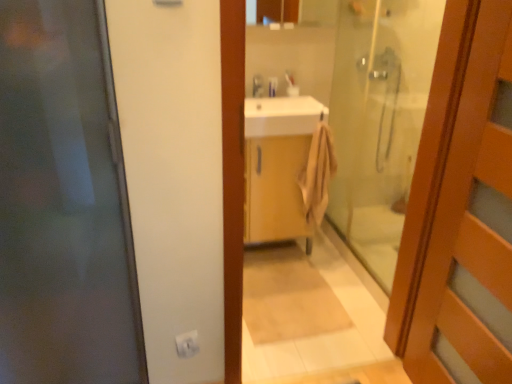
Image resolution: width=512 pixels, height=384 pixels. What do you see at coordinates (273, 86) in the screenshot?
I see `white plastic toothbrush at center, marked as the second toiletry in a right-to-left arrangement` at bounding box center [273, 86].

Image resolution: width=512 pixels, height=384 pixels. Identify the location of wooden door at right, which is the first door in right-to-left order. (472, 227).

Where is `matte silver faucet at upper center`? This screenshot has height=384, width=512. matte silver faucet at upper center is located at coordinates 257,86.

Is white plastic toothbrush at center, the first toiletry in the left-to-right sequence, not inside white plastic electric outlet at lower center?

white plastic toothbrush at center, the first toiletry in the left-to-right sequence, lies outside white plastic electric outlet at lower center's area.

Does white plastic toothbrush at center, the first toiletry in the left-to-right sequence, appear on the right side of white plastic electric outlet at lower center?

Yes, white plastic toothbrush at center, the first toiletry in the left-to-right sequence, is to the right of white plastic electric outlet at lower center.

Does point (270, 93) appear closer or farther from the camera than point (194, 344)?

Point (270, 93) is positioned farther from the camera compared to point (194, 344).

Is white plastic toothbrush at center, marked as the second toiletry in a right-to-left arrangement, oriented away from white plastic electric outlet at lower center?

No, white plastic toothbrush at center, marked as the second toiletry in a right-to-left arrangement,'s orientation is not away from white plastic electric outlet at lower center.

Is wooden door at right, which appears as the 2th door when viewed from the left, shorter than white glossy sink at center?

Incorrect, the height of wooden door at right, which appears as the 2th door when viewed from the left, does not fall short of that of white glossy sink at center.

Is the surface of wooden door at right, which is the first door in right-to-left order, in direct contact with white glossy sink at center?

wooden door at right, which is the first door in right-to-left order, is not next to white glossy sink at center, and they're not touching.

Locate an element on the screen. the 2nd door below the white glossy sink at center (from the image's perspective) is located at coordinates (472, 227).

From a real-world perspective, is wooden door at right, which is the first door in right-to-left order, above or below white glossy sink at center?

Clearly, from a real-world perspective, wooden door at right, which is the first door in right-to-left order, is below white glossy sink at center.

Is point (508, 326) closer or farther from the camera than point (314, 201)?

Clearly, point (508, 326) is closer to the camera than point (314, 201).

Does wooden door at right, which is the first door in right-to-left order, have a greater width compared to beige cotton towel at center?

In fact, wooden door at right, which is the first door in right-to-left order, might be narrower than beige cotton towel at center.

Is wooden door at right, which is the first door in right-to-left order, aimed at beige cotton towel at center?

No, wooden door at right, which is the first door in right-to-left order, is not oriented towards beige cotton towel at center.

In the scene shown: How many degrees apart are the facing directions of wooden door at right, which is the first door in right-to-left order, and beige cotton towel at center?

The angular difference between wooden door at right, which is the first door in right-to-left order, and beige cotton towel at center is 90.7 degrees.

Which of these two, white plastic electric outlet at lower center or white glossy sink at center, is bigger?

white glossy sink at center is bigger.

From the image's perspective, does white plastic electric outlet at lower center appear lower than white glossy sink at center?

Yes, from the image's perspective, white plastic electric outlet at lower center is beneath white glossy sink at center.

This screenshot has width=512, height=384. What are the coordinates of `sink that is above the white plastic electric outlet at lower center (from a real-world perspective)` in the screenshot? It's located at (283, 116).

In terms of width, does beige cotton towel at center look wider or thinner when compared to white plastic toothbrush at center, the first toiletry in the left-to-right sequence?

In the image, beige cotton towel at center appears to be wider than white plastic toothbrush at center, the first toiletry in the left-to-right sequence.

Is point (304, 192) in front of point (277, 78)?

That is True.

From a real-world perspective, is white plastic toothbrush at center, the first toiletry in the left-to-right sequence, positioned above or below wooden cabinet at center?

white plastic toothbrush at center, the first toiletry in the left-to-right sequence, is situated higher than wooden cabinet at center in the real world.

Which is more to the left, white plastic toothbrush at center, the first toiletry in the left-to-right sequence, or wooden cabinet at center?

white plastic toothbrush at center, the first toiletry in the left-to-right sequence, is more to the left.

Locate an element on the screen. The height and width of the screenshot is (384, 512). cabinetry lying on the right of white plastic toothbrush at center, the first toiletry in the left-to-right sequence is located at coordinates (275, 189).

Is white plastic toothbrush at center, marked as the second toiletry in a right-to-left arrangement, looking in the opposite direction of wooden cabinet at center?

No.

Visually, is matte silver faucet at upper center positioned to the left or to the right of wooden cabinet at center?

In the image, matte silver faucet at upper center appears on the left side of wooden cabinet at center.

Relative to wooden cabinet at center, is matte silver faucet at upper center in front or behind?

In the image, matte silver faucet at upper center appears behind wooden cabinet at center.

Measure the distance from matte silver faucet at upper center to wooden cabinet at center.

matte silver faucet at upper center is 57.16 centimeters away from wooden cabinet at center.

Is matte silver faucet at upper center not inside wooden cabinet at center?

Yes, matte silver faucet at upper center is not within wooden cabinet at center.

Starting from the white plastic electric outlet at lower center, which toiletry is the 1st one behind? Please provide its 2D coordinates.

[(273, 86)]

You are a GUI agent. You are given a task and a screenshot of the screen. Output one action in this format:
    pyautogui.click(x=<x>, y=<y>)
    Task: Click on the sink on the left of the wooden door at right, which appears as the 2th door when viewed from the left
    The height and width of the screenshot is (384, 512).
    Given the screenshot: What is the action you would take?
    pyautogui.click(x=283, y=116)

Considering their positions, is white plastic toothbrush at upper center, which is the 1th toiletry from right to left, positioned closer to white plastic toothbrush at center, the first toiletry in the left-to-right sequence, than transparent glass shower door at center?

white plastic toothbrush at upper center, which is the 1th toiletry from right to left, is positioned closer to the anchor white plastic toothbrush at center, the first toiletry in the left-to-right sequence.

Estimate the real-world distances between objects in this image. Which object is closer to white plastic toothbrush at upper center, which is the 1th toiletry from right to left, white glossy sink at center or wooden door at right, which appears as the 2th door when viewed from the left?

white glossy sink at center is closer to white plastic toothbrush at upper center, which is the 1th toiletry from right to left.

Considering their positions, is transparent glass door at left, the 1th door when ordered from left to right, positioned closer to wooden door at right, which is the first door in right-to-left order, than wooden cabinet at center?

wooden cabinet at center lies closer to wooden door at right, which is the first door in right-to-left order, than the other object.

From the image, which object appears to be nearer to wooden cabinet at center, white plastic toothbrush at upper center, which is the 1th toiletry from right to left, or beige cotton towel at center?

beige cotton towel at center.

Estimate the real-world distances between objects in this image. Which object is further from wooden cabinet at center, wooden door at right, which appears as the 2th door when viewed from the left, or transparent glass door at left, the 1th door when ordered from left to right?

Among the two, transparent glass door at left, the 1th door when ordered from left to right, is located further to wooden cabinet at center.

Considering their positions, is transparent glass door at left, the 1th door when ordered from left to right, positioned closer to white plastic toothbrush at upper center, the 2th toiletry when ordered from left to right, than white plastic toothbrush at center, marked as the second toiletry in a right-to-left arrangement?

white plastic toothbrush at center, marked as the second toiletry in a right-to-left arrangement.

When comparing their distances from transparent glass shower door at center, does white plastic toothbrush at center, marked as the second toiletry in a right-to-left arrangement, or white plastic electric outlet at lower center seem closer?

white plastic toothbrush at center, marked as the second toiletry in a right-to-left arrangement.

Based on their spatial positions, is beige cotton towel at center or wooden cabinet at center further from transparent glass door at left, the second door in the right-to-left sequence?

Based on the image, beige cotton towel at center appears to be further to transparent glass door at left, the second door in the right-to-left sequence.

At what (x,y) coordinates should I click in order to perform the action: click on screen door between matte silver faucet at upper center and white plastic electric outlet at lower center vertically. Please return your answer as a coordinate pair (x, y). Looking at the image, I should click on (379, 120).

Find the location of a particular element. cabinetry located between transparent glass door at left, the 1th door when ordered from left to right, and white plastic toothbrush at upper center, the 2th toiletry when ordered from left to right, in the depth direction is located at coordinates (275, 189).

What are the coordinates of `electric outlet located between wooden door at right, which is the first door in right-to-left order, and wooden cabinet at center in the depth direction` in the screenshot? It's located at (187, 344).

Locate an element on the screen. bath towel between transparent glass door at left, the second door in the right-to-left sequence, and transparent glass shower door at center, in the horizontal direction is located at coordinates (318, 174).